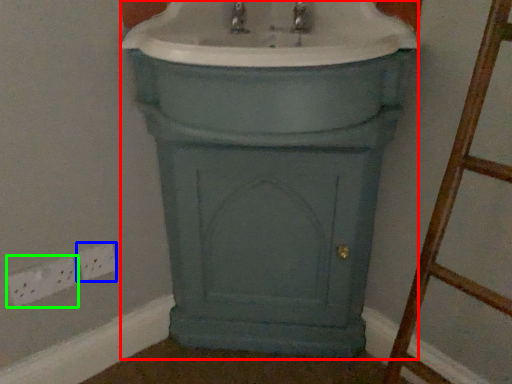
Question: Based on their relative distances, which object is nearer to porcelain (highlighted by a red box)? Choose from electric outlet (highlighted by a blue box) and electric outlet (highlighted by a green box).

Choices:
 (A) electric outlet
 (B) electric outlet

Answer: (A)